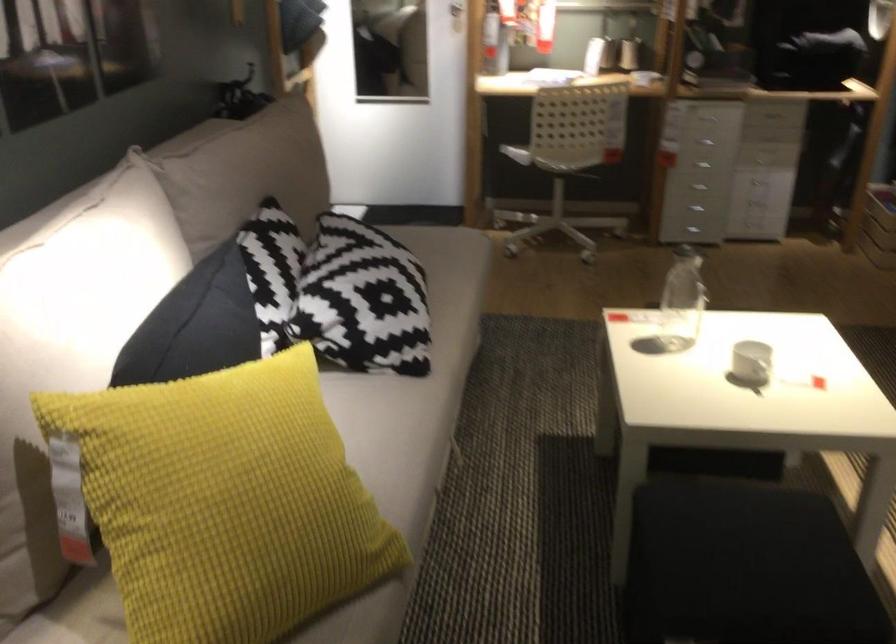
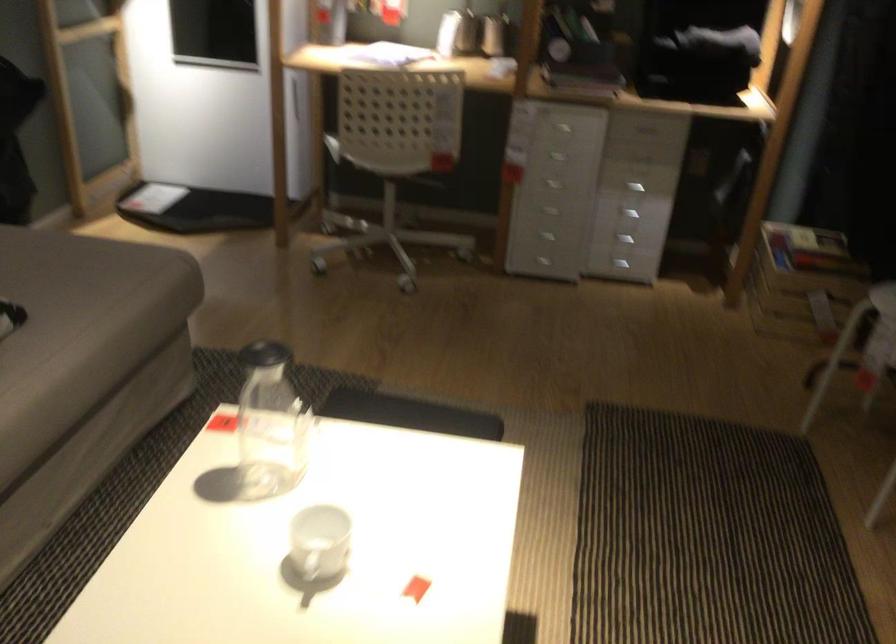
In the second image, find the point that corresponds to point 717,107 in the first image.

(563, 128)